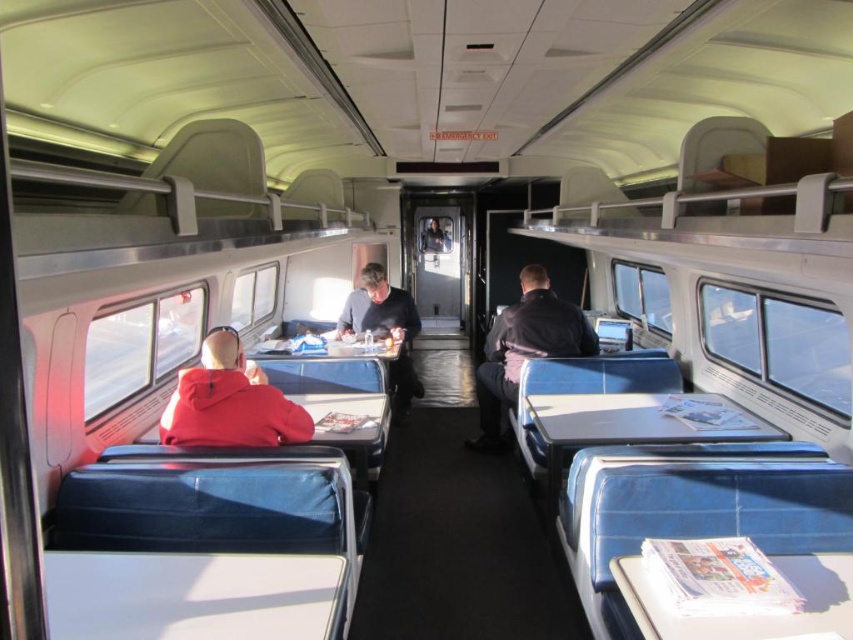
Question: Does red fleece jacket at left have a larger size compared to dark blue leather jacket at center?

Choices:
 (A) no
 (B) yes

Answer: (A)

Question: Among these objects, which one is farthest from the camera?

Choices:
 (A) red fleece jacket at left
 (B) dark gray jacket at center
 (C) dark blue leather jacket at center

Answer: (B)

Question: Which point is farther from the camera taking this photo?

Choices:
 (A) (488, 410)
 (B) (212, 337)

Answer: (A)

Question: In this image, where is red fleece jacket at left located relative to dark blue leather jacket at center?

Choices:
 (A) right
 (B) left

Answer: (B)

Question: Which of these objects is positioned closest to the red fleece jacket at left?

Choices:
 (A) dark blue leather jacket at center
 (B) dark gray jacket at center

Answer: (A)

Question: Can you confirm if red fleece jacket at left is positioned below dark gray jacket at center?

Choices:
 (A) no
 (B) yes

Answer: (B)